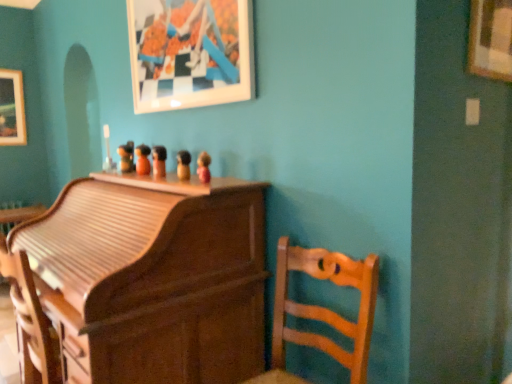
What do you see at coordinates (190, 53) in the screenshot? The image size is (512, 384). I see `matte white picture frame at upper center, which appears as the second picture frame when viewed from the left` at bounding box center [190, 53].

The height and width of the screenshot is (384, 512). Identify the location of wooden figurine at center, which ranks as the fifth toy in front-to-back order. (126, 157).

In order to face wooden figurine at center, which ranks as the fifth toy in front-to-back order, should I rotate leftwards or rightwards?

Turn left approximately 17.466 degrees to face it.

Identify the location of wooden toy at center, the 4th toy from the front. (143, 159).

Locate an element on the screen. Image resolution: width=512 pixels, height=384 pixels. matte white picture frame at upper center, which appears as the second picture frame when viewed from the left is located at coordinates (190, 53).

Considering the relative sizes of wooden figurine at center, placed as the third toy when sorted from front to back, and wooden figurine at center, the 2th toy from the front, in the image provided, is wooden figurine at center, placed as the third toy when sorted from front to back, wider than wooden figurine at center, the 2th toy from the front,?

Indeed, wooden figurine at center, placed as the third toy when sorted from front to back, has a greater width compared to wooden figurine at center, the 2th toy from the front.

Which is nearer, (161, 145) or (186, 174)?

Point (161, 145).

Considering the sizes of wooden figurine at center, which is the 3th toy from left to right, and wooden figurine at center, the 2th toy from the front, in the image, is wooden figurine at center, which is the 3th toy from left to right, taller or shorter than wooden figurine at center, the 2th toy from the front,?

Clearly, wooden figurine at center, which is the 3th toy from left to right, is taller compared to wooden figurine at center, the 2th toy from the front.

Is the position of wooden figurine at center, the third toy when ordered from right to left, less distant than that of wooden figurine at center, placed as the fourth toy when sorted from back to front?

No, wooden figurine at center, the third toy when ordered from right to left, is behind wooden figurine at center, placed as the fourth toy when sorted from back to front.

Considering the sizes of wooden figurine at center, the first toy when ordered from back to front, and wooden figurine at center, the 2th toy from the front, in the image, is wooden figurine at center, the first toy when ordered from back to front, bigger or smaller than wooden figurine at center, the 2th toy from the front,?

In the image, wooden figurine at center, the first toy when ordered from back to front, appears to be larger than wooden figurine at center, the 2th toy from the front.

Is wooden figurine at center, marked as the second toy in a right-to-left arrangement, inside wooden figurine at center, the 5th toy when ordered from right to left?

That's incorrect, wooden figurine at center, marked as the second toy in a right-to-left arrangement, is not inside wooden figurine at center, the 5th toy when ordered from right to left.

Is wooden figurine at center, the first toy when ordered from back to front, shorter than wooden figurine at center, the 2th toy from the front?

In fact, wooden figurine at center, the first toy when ordered from back to front, may be taller than wooden figurine at center, the 2th toy from the front.

Which object is thinner, wooden figurine at center, the 5th toy when ordered from right to left, or wooden figurine at center, marked as the second toy in a right-to-left arrangement?

Thinner between the two is wooden figurine at center, marked as the second toy in a right-to-left arrangement.

Between wooden toy at center, arranged as the second toy when viewed from the back, and wooden chair at center, which is the 2th furniture in left-to-right order, which one is positioned behind?

wooden toy at center, arranged as the second toy when viewed from the back, is further from the camera.

In the scene shown: Is wooden chair at center, which is the 2th furniture in left-to-right order, inside wooden toy at center, arranged as the second toy when viewed from the back?

No.

Based on the photo, which object is positioned more to the right, wooden toy at center, arranged as the second toy when viewed from the back, or wooden chair at center, the 1th furniture positioned from the right?

Positioned to the right is wooden chair at center, the 1th furniture positioned from the right.

Is wooden toy at center, the 4th toy from the front, not close to wooden chair at center, which is the 2th furniture in left-to-right order?

wooden toy at center, the 4th toy from the front, is positioned a significant distance from wooden chair at center, which is the 2th furniture in left-to-right order.

Does point (488, 24) appear closer or farther from the camera than point (187, 170)?

Point (488, 24) appears to be closer to the viewer than point (187, 170).

Is wooden figurine at center, marked as the second toy in a right-to-left arrangement, completely or partially inside wooden picture frame at upper right, the 3th picture frame positioned from the left?

No, wooden figurine at center, marked as the second toy in a right-to-left arrangement, is not surrounded by wooden picture frame at upper right, the 3th picture frame positioned from the left.

From a real-world perspective, which toy is the 4th one underneath the wooden picture frame at upper right, placed as the 1th picture frame when sorted from front to back? Please provide its 2D coordinates.

[(183, 165)]

Is wooden toy at center, the 4th toy positioned from the right, at the back of matte wooden figurine at center, the first toy in the right-to-left sequence?

No, matte wooden figurine at center, the first toy in the right-to-left sequence, is not facing away from wooden toy at center, the 4th toy positioned from the right.

Based on the photo, is matte wooden figurine at center, the first toy viewed from the front, inside the boundaries of wooden toy at center, arranged as the second toy when viewed from the back, or outside?

matte wooden figurine at center, the first toy viewed from the front, is outside wooden toy at center, arranged as the second toy when viewed from the back.

Would you consider matte wooden figurine at center, the first toy in the right-to-left sequence, to be distant from wooden toy at center, the 4th toy from the front?

They are positioned close to each other.

Considering the relative sizes of matte wooden figurine at center, which is the 5th toy in back-to-front order, and wooden toy at center, the 4th toy from the front, in the image provided, is matte wooden figurine at center, which is the 5th toy in back-to-front order, taller than wooden toy at center, the 4th toy from the front,?

No, matte wooden figurine at center, which is the 5th toy in back-to-front order, is not taller than wooden toy at center, the 4th toy from the front.

In the scene shown: From the image's perspective, is matte white picture frame at upper center, the second picture frame viewed from the right, under wooden figurine at center, placed as the fourth toy when sorted from back to front?

No.

The height and width of the screenshot is (384, 512). I want to click on the 2nd picture frame positioned above the wooden figurine at center, marked as the second toy in a right-to-left arrangement (from the image's perspective), so click(190, 53).

Would you say matte white picture frame at upper center, the second picture frame viewed from the back, is a long distance from wooden figurine at center, marked as the second toy in a right-to-left arrangement?

They are positioned close to each other.

From the picture: Does matte white picture frame at upper center, the second picture frame positioned from the front, have a smaller size compared to wooden figurine at center, placed as the fourth toy when sorted from back to front?

No.

Based on their sizes in the image, would you say wooden picture frame at upper right, the 1th picture frame from the right, is bigger or smaller than wooden figurine at center, the 1th toy when ordered from left to right?

In the image, wooden picture frame at upper right, the 1th picture frame from the right, appears to be larger than wooden figurine at center, the 1th toy when ordered from left to right.

Is wooden picture frame at upper right, the 3th picture frame positioned from the left, positioned far away from wooden figurine at center, the 5th toy when ordered from right to left?

Indeed, wooden picture frame at upper right, the 3th picture frame positioned from the left, is not near wooden figurine at center, the 5th toy when ordered from right to left.

From the image's perspective, is wooden picture frame at upper right, the third picture frame in the back-to-front sequence, over wooden figurine at center, which ranks as the fifth toy in front-to-back order?

Yes, from the image's perspective, wooden picture frame at upper right, the third picture frame in the back-to-front sequence, is above wooden figurine at center, which ranks as the fifth toy in front-to-back order.

Locate an element on the screen. This screenshot has height=384, width=512. toy that is the 1st one when counting leftward from the wooden figurine at center, marked as the second toy in a right-to-left arrangement is located at coordinates (159, 161).

Image resolution: width=512 pixels, height=384 pixels. There is a wooden figurine at center, the 2th toy from the front. Find the location of `the 2nd toy above it (from a real-world perspective)`. the 2nd toy above it (from a real-world perspective) is located at coordinates (126, 157).

Estimate the real-world distances between objects in this image. Which object is further from wooden figurine at center, which is counted as the fourth toy, starting from the left, wooden roll-top desk at center, acting as the 1th furniture starting from the left, or matte wooden figurine at center, the first toy in the right-to-left sequence?

wooden roll-top desk at center, acting as the 1th furniture starting from the left, is further to wooden figurine at center, which is counted as the fourth toy, starting from the left.

Based on their spatial positions, is wooden figurine at center, which is counted as the fourth toy, starting from the left, or wooden roll-top desk at center, which is the second furniture in right-to-left order, further from matte wooden figurine at center, which is the 5th toy in back-to-front order?

wooden roll-top desk at center, which is the second furniture in right-to-left order, is positioned further to the anchor matte wooden figurine at center, which is the 5th toy in back-to-front order.

From the image, which object appears to be farther from wooden chair at center, the 1th furniture positioned from the right, wooden picture frame at upper right, the 1th picture frame from the right, or wooden figurine at center, the 1th toy when ordered from left to right?

Based on the image, wooden figurine at center, the 1th toy when ordered from left to right, appears to be further to wooden chair at center, the 1th furniture positioned from the right.

Which object lies nearer to the anchor point wooden picture frame at upper right, the 3th picture frame positioned from the left, wooden figurine at center, positioned as the 3th toy in back-to-front order, or matte white picture frame at upper center, the second picture frame positioned from the front?

matte white picture frame at upper center, the second picture frame positioned from the front, lies closer to wooden picture frame at upper right, the 3th picture frame positioned from the left, than the other object.

When comparing their distances from wooden picture frame at upper left, positioned as the 3th picture frame in right-to-left order, does wooden roll-top desk at center, acting as the 1th furniture starting from the left, or wooden figurine at center, positioned as the 3th toy in back-to-front order, seem closer?

wooden figurine at center, positioned as the 3th toy in back-to-front order, lies closer to wooden picture frame at upper left, positioned as the 3th picture frame in right-to-left order, than the other object.

When comparing their distances from wooden picture frame at upper right, the third picture frame in the back-to-front sequence, does wooden figurine at center, placed as the fourth toy when sorted from back to front, or wooden toy at center, the 4th toy from the front, seem further?

Based on the image, wooden toy at center, the 4th toy from the front, appears to be further to wooden picture frame at upper right, the third picture frame in the back-to-front sequence.

Looking at the image, which one is located further to matte white picture frame at upper center, the second picture frame viewed from the back, wooden toy at center, the 4th toy from the front, or wooden figurine at center, which ranks as the fifth toy in front-to-back order?

The object further to matte white picture frame at upper center, the second picture frame viewed from the back, is wooden figurine at center, which ranks as the fifth toy in front-to-back order.

Estimate the real-world distances between objects in this image. Which object is further from wooden picture frame at upper left, positioned as the 1th picture frame in back-to-front order, wooden roll-top desk at center, acting as the 1th furniture starting from the left, or wooden picture frame at upper right, placed as the 1th picture frame when sorted from front to back?

wooden picture frame at upper right, placed as the 1th picture frame when sorted from front to back, is further to wooden picture frame at upper left, positioned as the 1th picture frame in back-to-front order.

The width and height of the screenshot is (512, 384). I want to click on toy between wooden figurine at center, placed as the third toy when sorted from front to back, and wooden figurine at center, the 1th toy when ordered from left to right, in the front-back direction, so pyautogui.click(x=143, y=159).

Find the location of a particular element. The image size is (512, 384). furniture between wooden toy at center, the 4th toy positioned from the right, and wooden picture frame at upper right, the third picture frame in the back-to-front sequence is located at coordinates (322, 310).

At what (x,y) coordinates should I click in order to perform the action: click on picture frame located between wooden toy at center, the 4th toy positioned from the right, and wooden picture frame at upper right, placed as the 1th picture frame when sorted from front to back, in the left-right direction. Please return your answer as a coordinate pair (x, y). The height and width of the screenshot is (384, 512). Looking at the image, I should click on (190, 53).

You are a GUI agent. You are given a task and a screenshot of the screen. Output one action in this format:
    pyautogui.click(x=<x>, y=<y>)
    Task: Click on the furniture between wooden figurine at center, which is counted as the fourth toy, starting from the left, and wooden picture frame at upper right, the 3th picture frame positioned from the left, from left to right
    
    Given the screenshot: What is the action you would take?
    (322, 310)